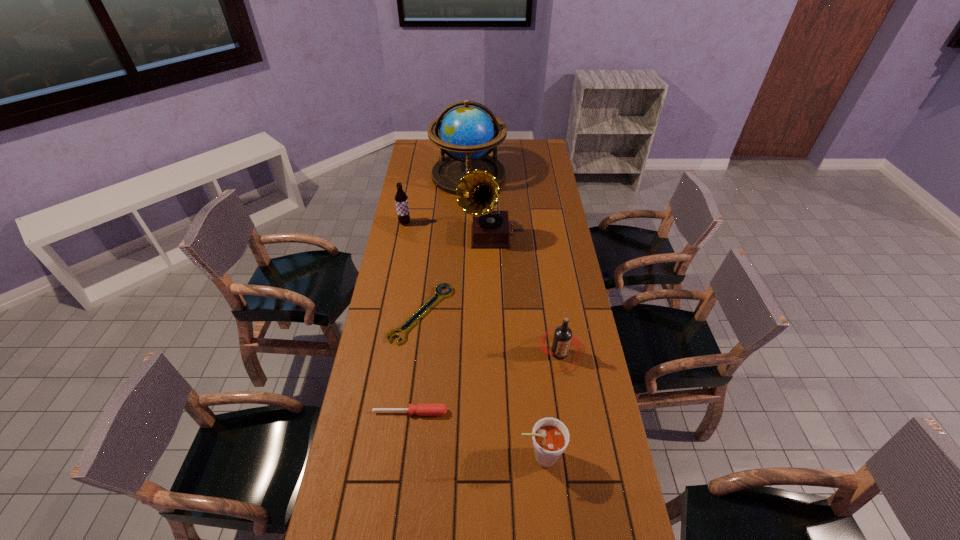
At what (x,y) coordinates should I click in order to perform the action: click on empty location between the second nearest root beer and the wrench. Please return your answer as a coordinate pair (x, y). The image size is (960, 540). Looking at the image, I should click on (491, 334).

Identify the location of free space between the screwdriver and the nearest object. The image size is (960, 540). (475, 435).

This screenshot has width=960, height=540. In order to click on vacant area that lies between the second nearest root beer and the phonograph record in this screenshot , I will do `click(525, 295)`.

Find the location of `unoccupied position between the farthest root beer and the farthest object`. unoccupied position between the farthest root beer and the farthest object is located at coordinates (437, 199).

The height and width of the screenshot is (540, 960). I want to click on free space between the nearest object and the second tallest object, so click(x=516, y=346).

This screenshot has height=540, width=960. I want to click on empty space that is in between the screwdriver and the second farthest root beer, so click(x=485, y=383).

Select which object is the sixth closest to the wrench. Please provide its 2D coordinates. Your answer should be formatted as a tuple, i.e. [(x, y)], where the tuple contains the x and y coordinates of a point satisfying the conditions above.

[(467, 134)]

Select which object is the third closest to the wrench. Please provide its 2D coordinates. Your answer should be formatted as a tuple, i.e. [(x, y)], where the tuple contains the x and y coordinates of a point satisfying the conditions above.

[(563, 336)]

The image size is (960, 540). Find the location of `the second closest root beer relative to the phonograph record`. the second closest root beer relative to the phonograph record is located at coordinates (563, 336).

Locate which root beer ranks third in proximity to the wrench. Please provide its 2D coordinates. Your answer should be formatted as a tuple, i.e. [(x, y)], where the tuple contains the x and y coordinates of a point satisfying the conditions above.

[(550, 437)]